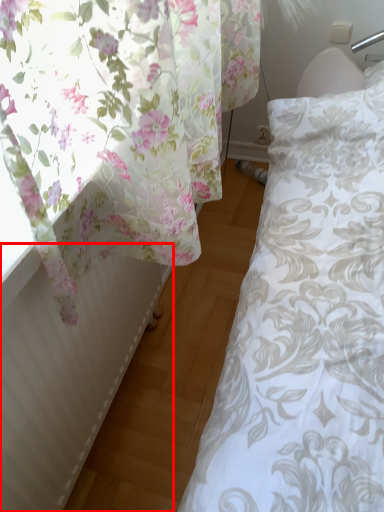
Question: From the image's perspective, considering the relative positions of radiator (annotated by the red box) and curtain in the image provided, where is radiator (annotated by the red box) located with respect to the staircase?

Choices:
 (A) above
 (B) below

Answer: (B)